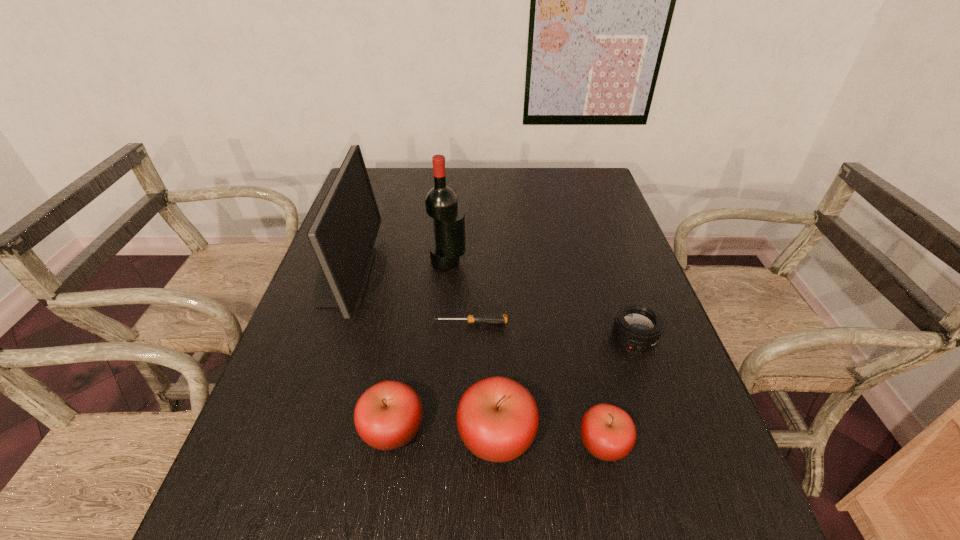
Please show where to add a apple on the right while keeping spacing even. Please provide its 2D coordinates. Your answer should be formatted as a tuple, i.e. [(x, y)], where the tuple contains the x and y coordinates of a point satisfying the conditions above.

[(713, 451)]